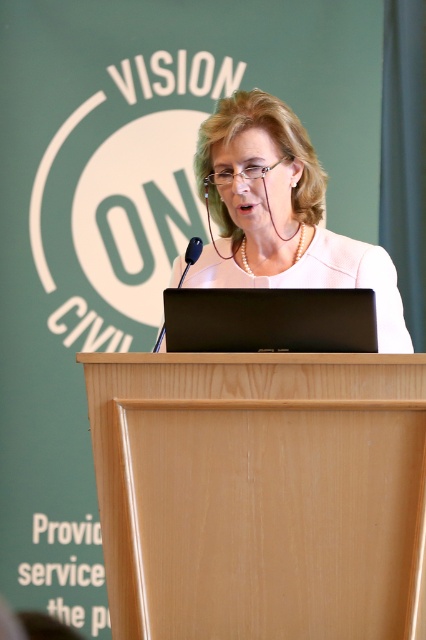
Who is lower down, white textured blazer at center or black plastic microphone at center?

black plastic microphone at center is below.

Is point (259, 113) farther from camera compared to point (157, 348)?

Yes, it is.

Is point (293, 200) in front of point (154, 349)?

No, (293, 200) is behind (154, 349).

The width and height of the screenshot is (426, 640). I want to click on white textured blazer at center, so 279,212.

Which of these two, black matte laptop at center or black plastic microphone at center, stands taller?

black plastic microphone at center

Between black matte laptop at center and black plastic microphone at center, which one is positioned lower?

Positioned lower is black matte laptop at center.

Does point (270, 326) lie behind point (198, 236)?

No.

The height and width of the screenshot is (640, 426). I want to click on black matte laptop at center, so click(270, 320).

Based on the photo, is light wood podium at center shorter than black plastic microphone at center?

No, light wood podium at center is not shorter than black plastic microphone at center.

Does light wood podium at center have a smaller size compared to black plastic microphone at center?

No, light wood podium at center is not smaller than black plastic microphone at center.

The image size is (426, 640). In order to click on light wood podium at center in this screenshot , I will do `click(259, 493)`.